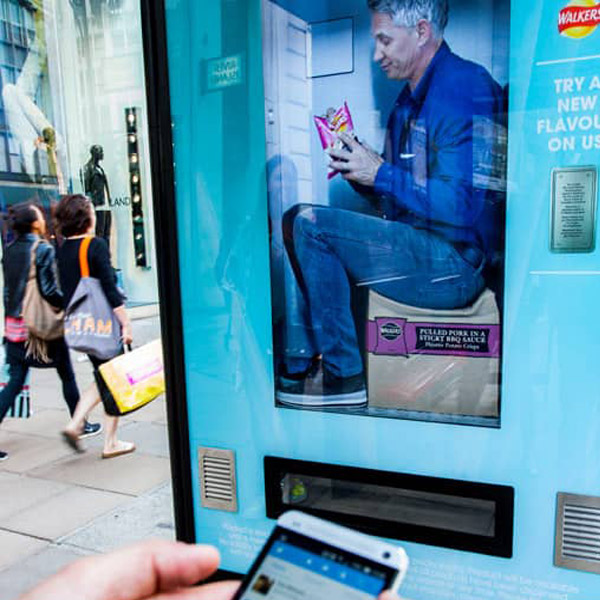
At what (x,y) coordinates should I click in order to perform the action: click on statue. Please return your answer as a coordinate pair (x, y). Image resolution: width=600 pixels, height=600 pixels. Looking at the image, I should click on (99, 182).